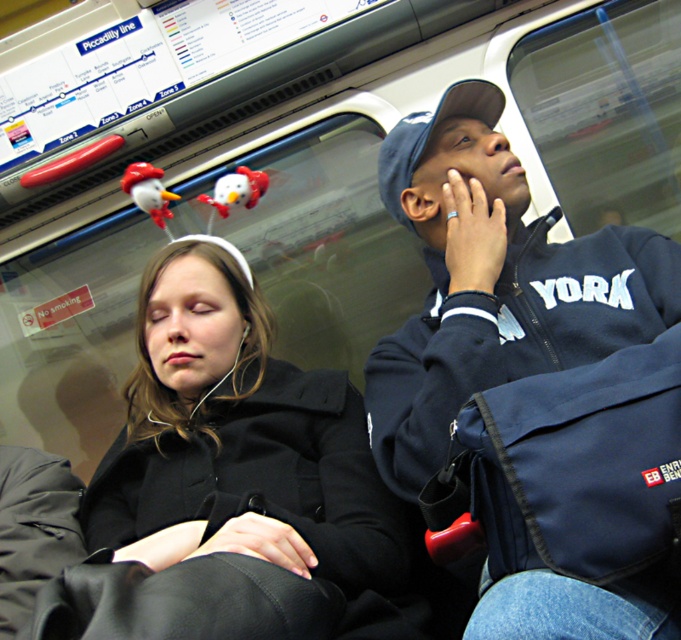
You are a tailor who needs to determine which garment requires more fabric for alterations. Based on the image, which of the two items, the black matte coat at center or the navy blue jacket at upper right, would need more fabric due to its size?

The black matte coat at center requires more fabric because its width is larger than the navy blue jacket at upper right.

You are a fashion designer observing the subway scene. You need to determine which of the two coats, the black matte coat at center or the navy blue jacket at upper right, would require less fabric to produce. Based on the scene, which one would you choose?

The black matte coat at center is shorter than the navy blue jacket at upper right, so it would require less fabric to produce.